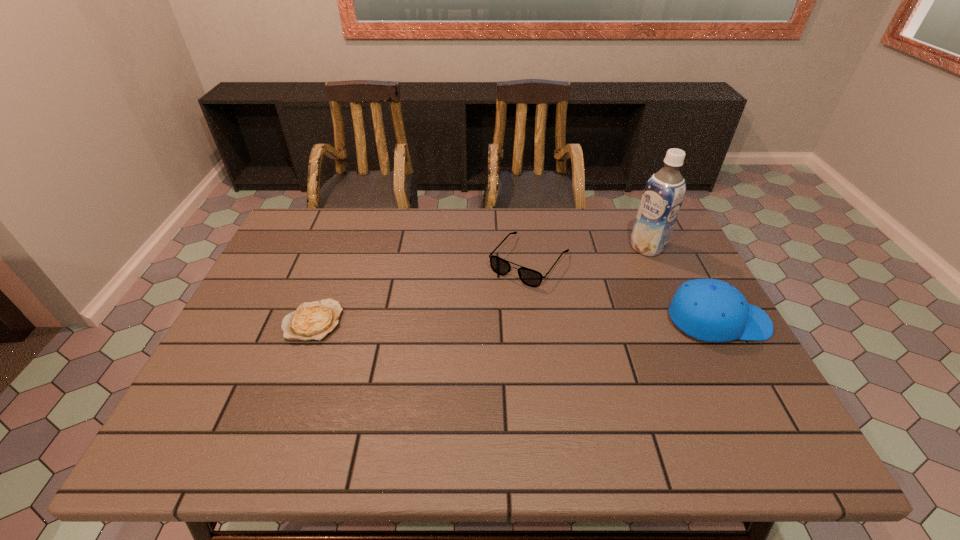
Find the location of a particular element. vacant space situated on the label of the tallest object is located at coordinates (570, 293).

The height and width of the screenshot is (540, 960). I want to click on vacant space located on the label of the tallest object, so click(x=552, y=303).

Locate an element on the screen. vacant space located on the label of the tallest object is located at coordinates (625, 260).

The height and width of the screenshot is (540, 960). I want to click on spectacles located in the far edge section of the desktop, so click(x=530, y=277).

Where is `soya milk that is at the far edge`? This screenshot has height=540, width=960. soya milk that is at the far edge is located at coordinates [664, 192].

The height and width of the screenshot is (540, 960). Find the location of `object that is at the left edge`. object that is at the left edge is located at coordinates (314, 320).

You are a GUI agent. You are given a task and a screenshot of the screen. Output one action in this format:
    pyautogui.click(x=<x>, y=<y>)
    Task: Click on the cap that is at the right edge
    Image resolution: width=960 pixels, height=540 pixels.
    Given the screenshot: What is the action you would take?
    pyautogui.click(x=711, y=310)

At what (x,y) coordinates should I click in order to perform the action: click on soya milk at the right edge. Please return your answer as a coordinate pair (x, y). The width and height of the screenshot is (960, 540). Looking at the image, I should click on (664, 192).

Where is `object situated at the far right corner`? The image size is (960, 540). object situated at the far right corner is located at coordinates (664, 192).

The width and height of the screenshot is (960, 540). In order to click on vacant point at the far edge in this screenshot , I will do `click(559, 212)`.